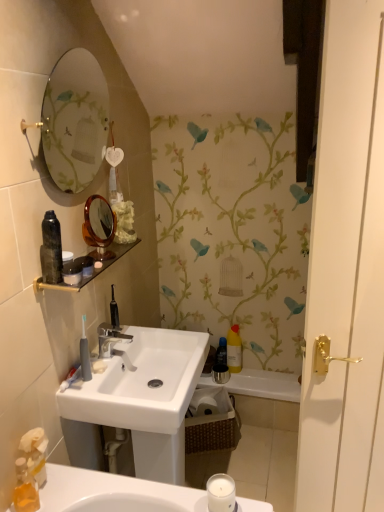
Question: Is silver metallic faucet at center in front of or behind white glossy bathtub at center in the image?

Choices:
 (A) front
 (B) behind

Answer: (A)

Question: From a real-world perspective, relative to white glossy bathtub at center, is silver metallic faucet at center vertically above or below?

Choices:
 (A) below
 (B) above

Answer: (B)

Question: Which of these objects is positioned farthest from the woven brown basket at lower center?

Choices:
 (A) white matte candle at lower center
 (B) translucent plastic soap dispenser at lower left
 (C) yellow matte bottle at center, which appears as the 2th toiletry when viewed from the left
 (D) matte glass shelf at upper center
 (E) white glossy bathtub at center

Answer: (B)

Question: Based on their relative distances, which object is nearer to the translucent plastic soap dispenser at lower left?

Choices:
 (A) matte glass shelf at upper center
 (B) silver metallic faucet at center
 (C) white glossy door handle at right
 (D) yellow matte bottle at center, the first toiletry positioned from the back
 (E) satin gold mirror at upper center

Answer: (B)